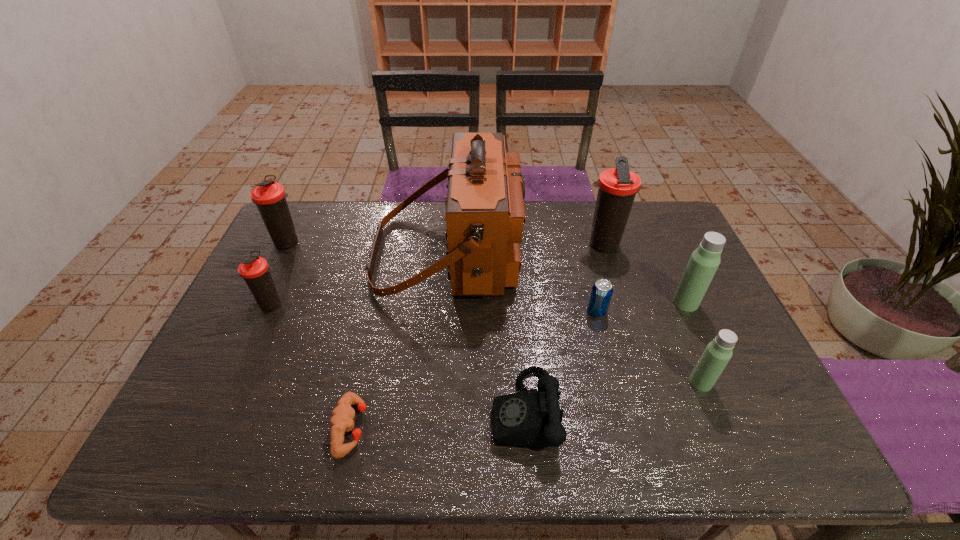
Locate an element on the screen. The height and width of the screenshot is (540, 960). telephone is located at coordinates (531, 418).

I want to click on puncher, so click(342, 417).

I want to click on red puncher, so click(x=342, y=417).

Identify the location of free point located on the face side of the tallest object. (x=620, y=254).

Locate an element on the screen. The image size is (960, 540). blank space located 0.320m on the front of the rightmost brown thermos bottle is located at coordinates (631, 338).

The width and height of the screenshot is (960, 540). In order to click on vacant area situated on the back of the second smallest brown thermos bottle in this screenshot , I will do click(306, 205).

Find the location of `blank area located on the back of the farther light thermos bottle`. blank area located on the back of the farther light thermos bottle is located at coordinates [658, 242].

I want to click on free location located on the front of the nearest brown thermos bottle, so click(x=261, y=328).

Where is `free space located on the right of the nearer light thermos bottle`? free space located on the right of the nearer light thermos bottle is located at coordinates (753, 382).

The width and height of the screenshot is (960, 540). I want to click on vacant space located on the back of the blue beer can, so click(583, 258).